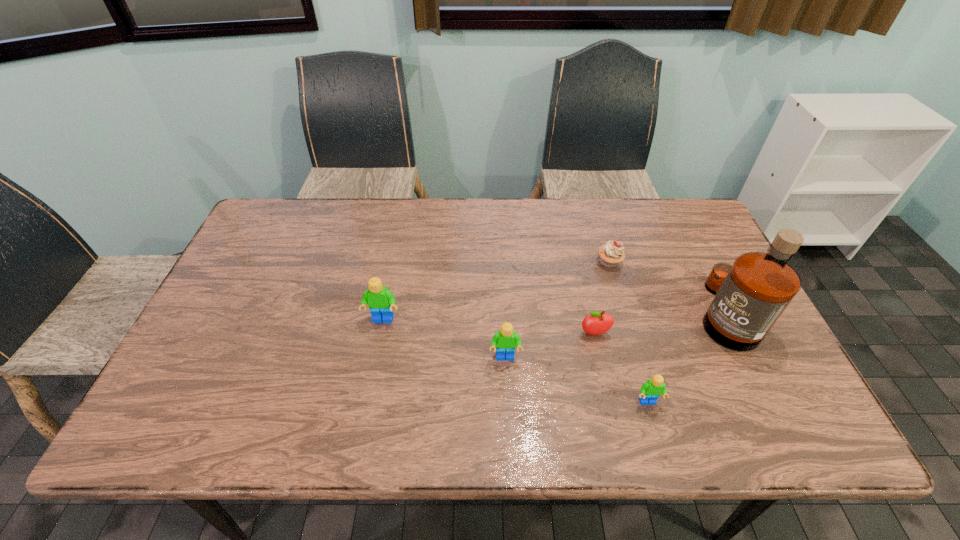
Identify the location of vacant region at the near edge of the desktop. point(416,397).

The height and width of the screenshot is (540, 960). Find the location of `vacant space at the far left corner of the desktop`. vacant space at the far left corner of the desktop is located at coordinates (305, 205).

In the image, there is a desktop. At what (x,y) coordinates should I click in order to perform the action: click on free region at the far right corner. Please return your answer as a coordinate pair (x, y). Looking at the image, I should click on (684, 201).

Find the location of a particular element. The height and width of the screenshot is (540, 960). vacant region at the near right corner of the desktop is located at coordinates (783, 370).

Locate an element on the screen. This screenshot has width=960, height=540. free space between the second nearest Lego and the rightmost object is located at coordinates (614, 335).

Locate an element on the screen. This screenshot has height=540, width=960. empty space that is in between the liquor and the rightmost Lego is located at coordinates (685, 357).

Where is `vacant space that's between the leftmost Lego and the third object from left to right`? vacant space that's between the leftmost Lego and the third object from left to right is located at coordinates (489, 327).

At what (x,y) coordinates should I click in order to perform the action: click on free spot between the farthest object and the fifth shortest object. Please return your answer as a coordinate pair (x, y). The image size is (960, 540). Looking at the image, I should click on (496, 291).

This screenshot has width=960, height=540. I want to click on free space between the farthest object and the second Lego from right to left, so click(x=557, y=310).

The height and width of the screenshot is (540, 960). What are the coordinates of `free space between the third tallest object and the tallest object` in the screenshot? It's located at (614, 335).